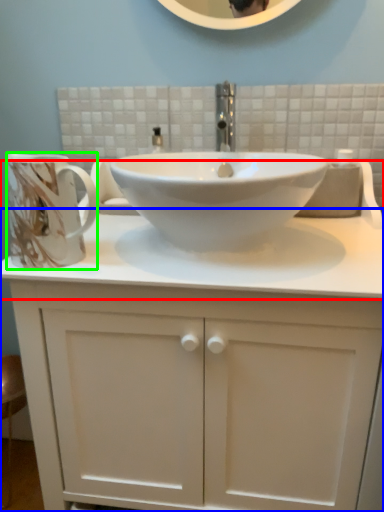
Question: Based on their relative distances, which object is nearer to counter top (highlighted by a red box)? Choose from bathroom cabinet (highlighted by a blue box) and mug (highlighted by a green box).

Choices:
 (A) bathroom cabinet
 (B) mug

Answer: (A)